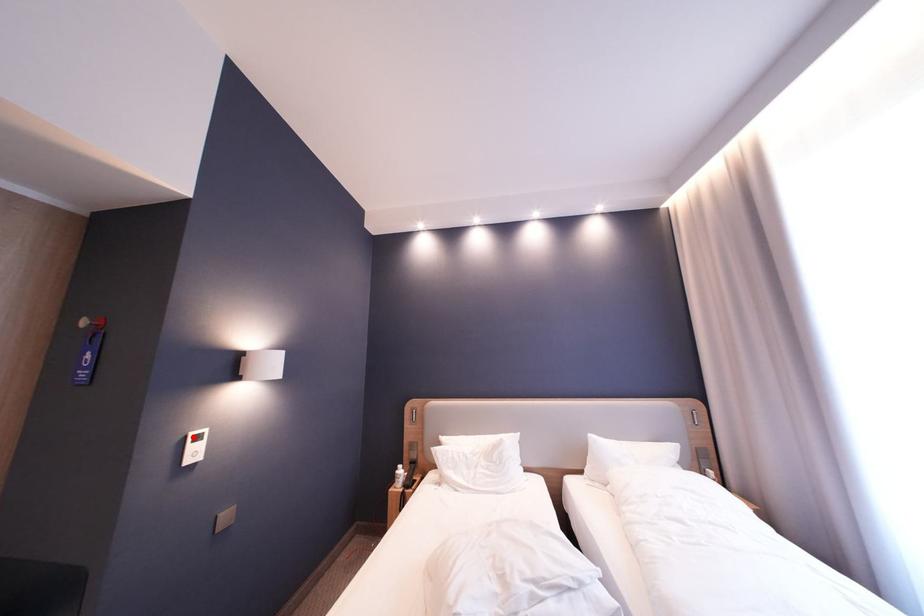
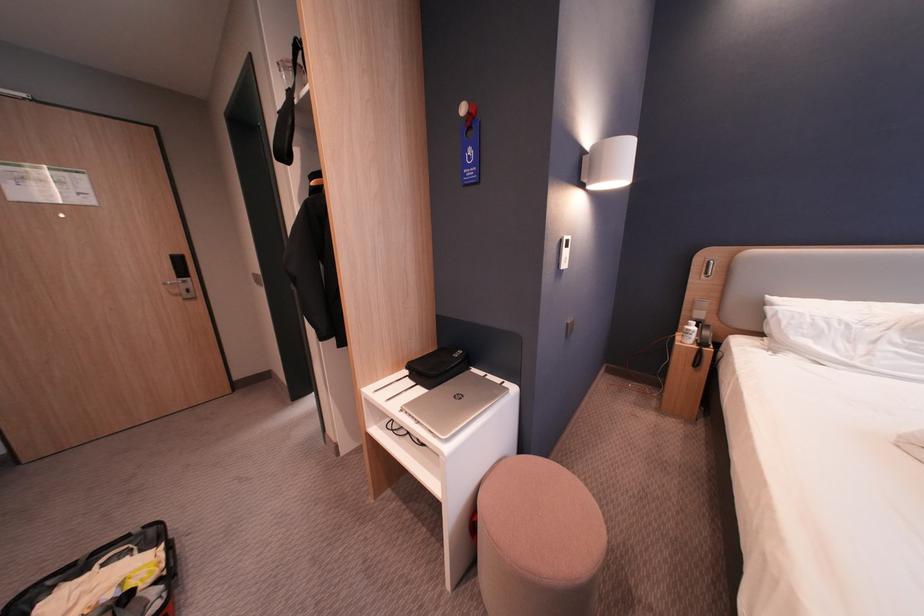
Locate, in the second image, the point that corresponds to the highlighted location in the first image.

(569, 240)